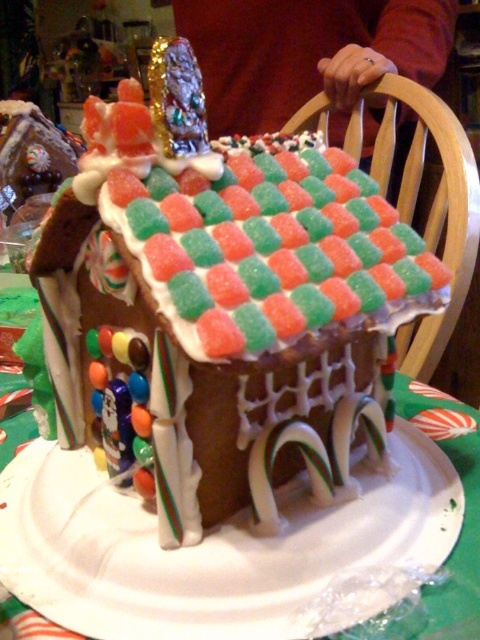
Describe the element at coordinates (220, 305) in the screenshot. The image size is (480, 640). I see `candy-coated gingerbread house at center` at that location.

Does point (322, 266) come farther from viewer compared to point (106, 524)?

No, it is in front of (106, 524).

Find the location of a particular element. The image size is (480, 640). candy-coated gingerbread house at center is located at coordinates (220, 305).